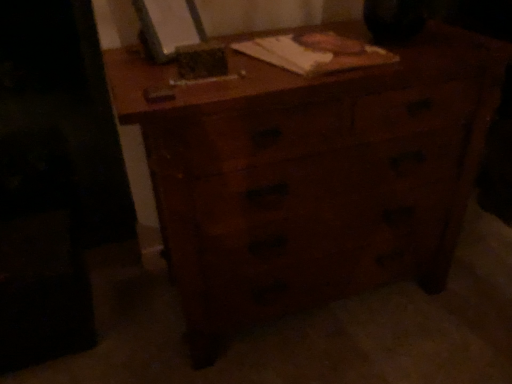
The height and width of the screenshot is (384, 512). In order to click on free point below wooden notebook at center (from a real-world perspective) in this screenshot , I will do `click(303, 55)`.